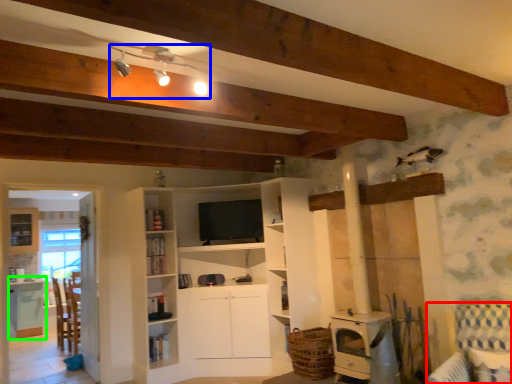
Question: Which object is positioned closest to armchair (highlighted by a red box)? Select from light fixture (highlighted by a blue box) and table (highlighted by a green box).

Choices:
 (A) light fixture
 (B) table

Answer: (A)